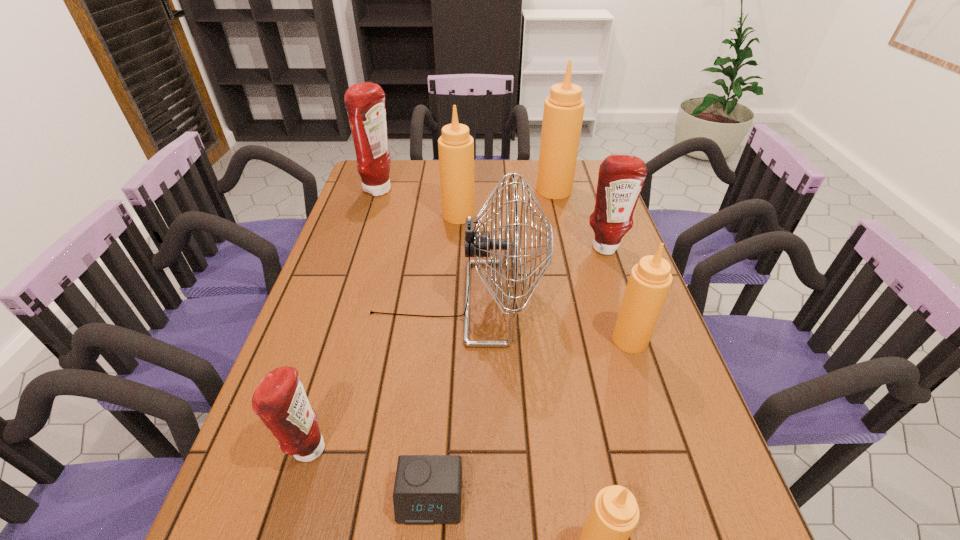
Identify the location of free space between the farthest red condiment and the fan. (419, 246).

Locate an element on the screen. This screenshot has width=960, height=540. vacant space that is in between the fan and the third smallest tan condiment is located at coordinates (458, 259).

Where is `the second closest object to the nearest tan condiment`? This screenshot has width=960, height=540. the second closest object to the nearest tan condiment is located at coordinates (478, 244).

Locate which object is the fourth closest to the third smallest tan condiment. Please provide its 2D coordinates. Your answer should be formatted as a tuple, i.e. [(x, y)], where the tuple contains the x and y coordinates of a point satisfying the conditions above.

[(621, 177)]

Identify which condiment is the third closest to the second biggest tan condiment. Please provide its 2D coordinates. Your answer should be formatted as a tuple, i.e. [(x, y)], where the tuple contains the x and y coordinates of a point satisfying the conditions above.

[(621, 177)]

What are the coordinates of `condiment identified as the fourth closest to the tallest object` in the screenshot? It's located at (649, 282).

Identify which tan condiment is the third closest to the smallest red condiment. Please provide its 2D coordinates. Your answer should be formatted as a tuple, i.e. [(x, y)], where the tuple contains the x and y coordinates of a point satisfying the conditions above.

[(456, 147)]

Locate an element on the screen. This screenshot has width=960, height=540. tan condiment that can be found as the closest to the third farthest tan condiment is located at coordinates (614, 515).

Identify which red condiment is the third closest to the third biggest tan condiment. Please provide its 2D coordinates. Your answer should be formatted as a tuple, i.e. [(x, y)], where the tuple contains the x and y coordinates of a point satisfying the conditions above.

[(365, 102)]

Image resolution: width=960 pixels, height=540 pixels. In order to click on red condiment that stands as the second closest to the nearest tan condiment in this screenshot , I will do `click(621, 177)`.